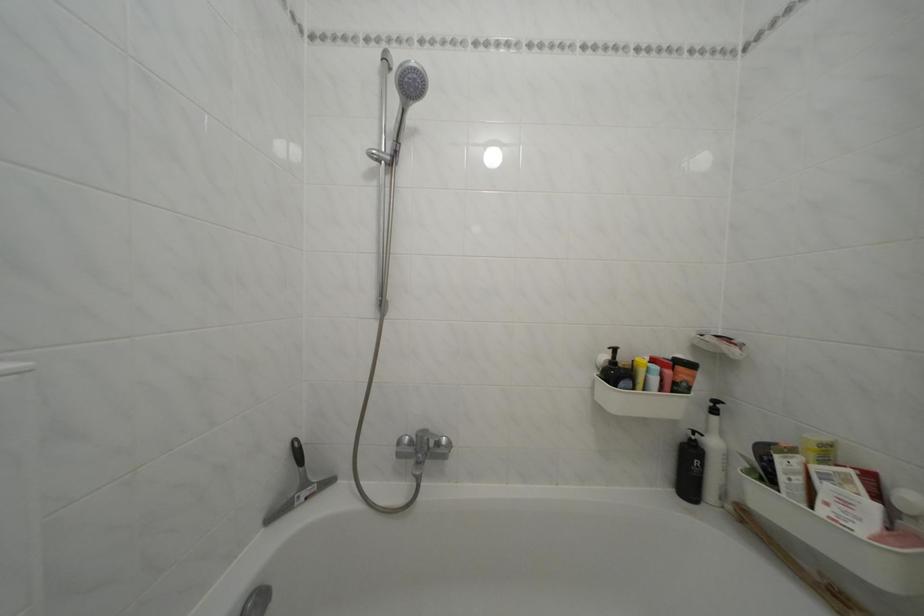
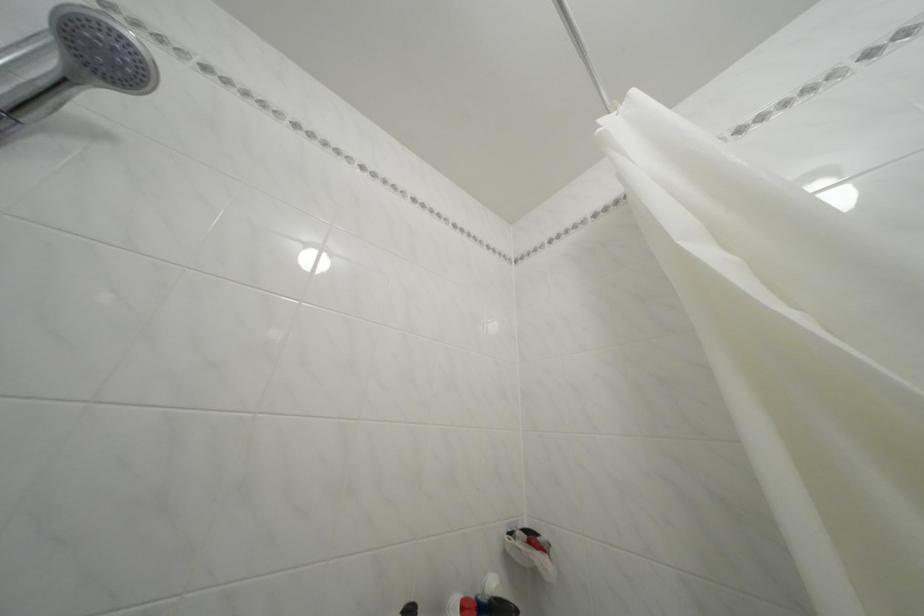
Based on the continuous images, in which direction is the camera rotating?

The rotation direction of the camera is right-up.